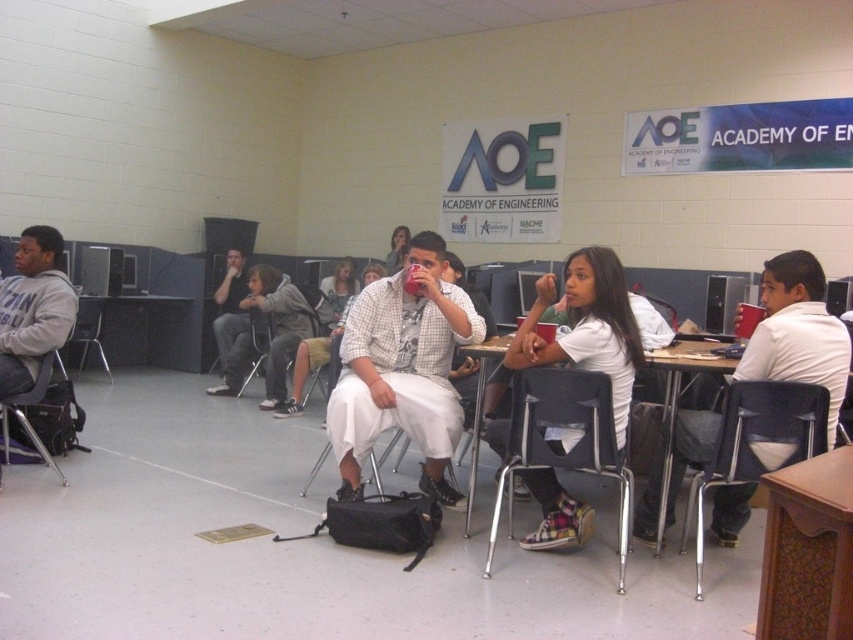
Is point (674, 470) less distant than point (231, 326)?

Yes, point (674, 470) is in front of point (231, 326).

Does white matte shirt at center appear over matte black shirt at center?

No, white matte shirt at center is not above matte black shirt at center.

Which is in front, point (756, 344) or point (236, 278)?

Point (756, 344) is in front.

At what (x,y) coordinates should I click in order to perform the action: click on white matte shirt at center. Please return your answer as a coordinate pair (x, y). This screenshot has width=853, height=640. Looking at the image, I should click on (798, 332).

Is metallic gray chair at center smaller than metallic gray chair at left?

Correct, metallic gray chair at center occupies less space than metallic gray chair at left.

The image size is (853, 640). What are the coordinates of `metallic gray chair at center` in the screenshot? It's located at (267, 353).

Who is more forward, (44, 378) or (91, 332)?

Point (44, 378) is more forward.

Can you confirm if metallic silver chair at left is bigger than metallic gray chair at left?

Incorrect, metallic silver chair at left is not larger than metallic gray chair at left.

This screenshot has height=640, width=853. I want to click on metallic silver chair at left, so click(x=25, y=416).